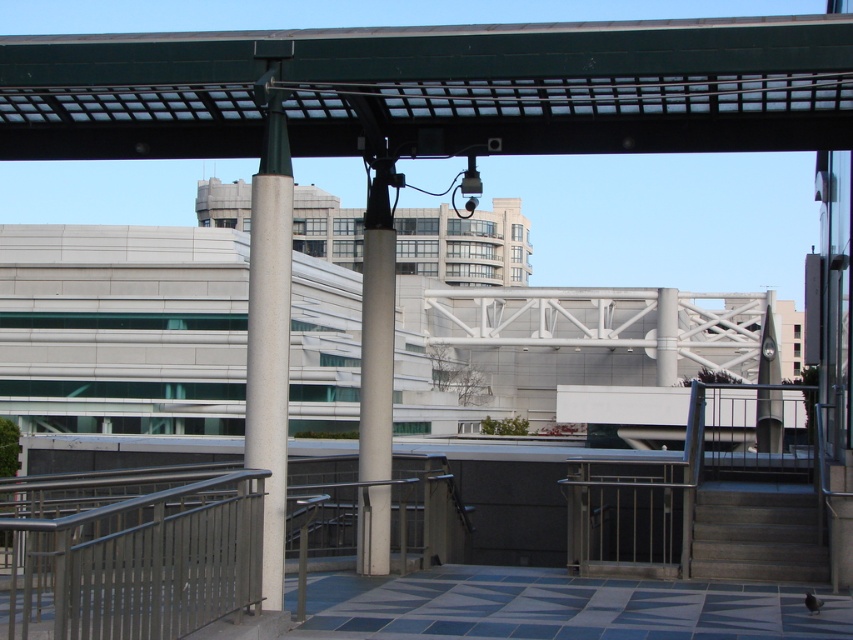
You are a delivery person carrying a package and need to navigate through the white concrete pillar at left and the dark gray concrete stairs at lower right. Which object is located to the left of the other?

The white concrete pillar at left is positioned on the left side of dark gray concrete stairs at lower right, so the pillar is to the left of the stairs.

You are standing at the center of the paved area in the urban scene. You need to locate the white concrete pillar at left. Based on its coordinates, which direction should you face to see it?

The white concrete pillar at left is located at coordinates point (x=270, y=328). Since you are at the center, facing the left side of the scene would align you with the pillar.

You are a delivery person carrying a large box that is 1 meter wide. You need to pass through the space between the white concrete pillar at left and the white smooth pole at center. Can you fit through the space?

The white concrete pillar at left might be wider than the white smooth pole at center, so it is uncertain if the space between them is wide enough for the 1 meter wide box. Check the actual width before proceeding.